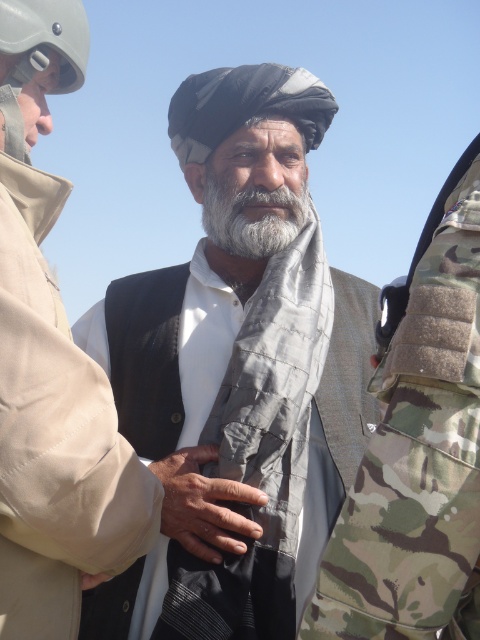
Question: Can you confirm if gray quilted scarf at center is thinner than dry skin at center?

Choices:
 (A) no
 (B) yes

Answer: (A)

Question: Estimate the real-world distances between objects in this image. Which object is farther from the gray quilted scarf at center?

Choices:
 (A) white soft beard at center
 (B) dry skin at center

Answer: (B)

Question: Which of the following is the closest to the observer?

Choices:
 (A) gray quilted scarf at center
 (B) dry skin at center
 (C) white matte scarf at center

Answer: (C)

Question: Which point is closer to the camera?

Choices:
 (A) (57, 365)
 (B) (204, 192)
 (C) (180, 508)
 (D) (241, 486)

Answer: (A)

Question: Is dry skin at center smaller than white soft beard at center?

Choices:
 (A) no
 (B) yes

Answer: (B)

Question: Does gray quilted scarf at center appear over white soft beard at center?

Choices:
 (A) yes
 (B) no

Answer: (B)